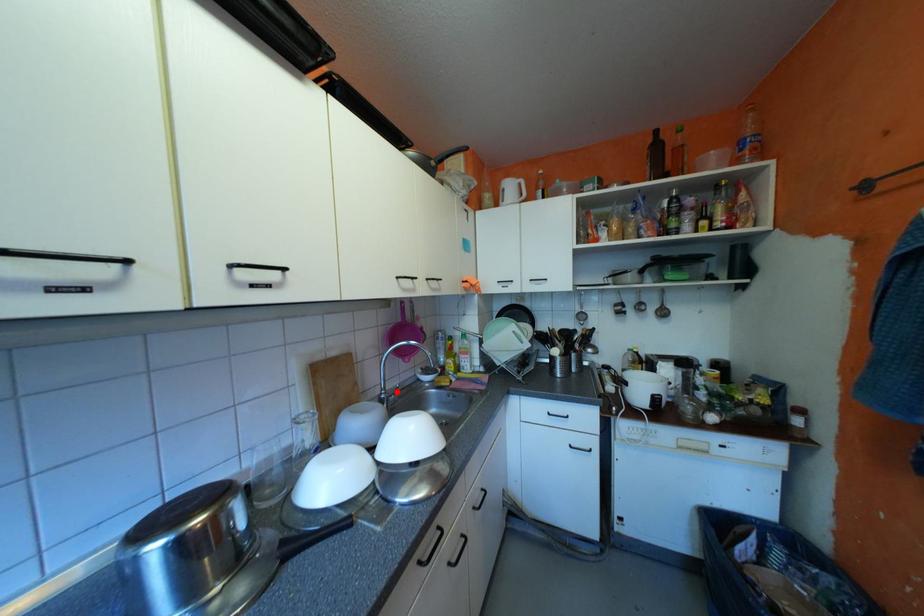
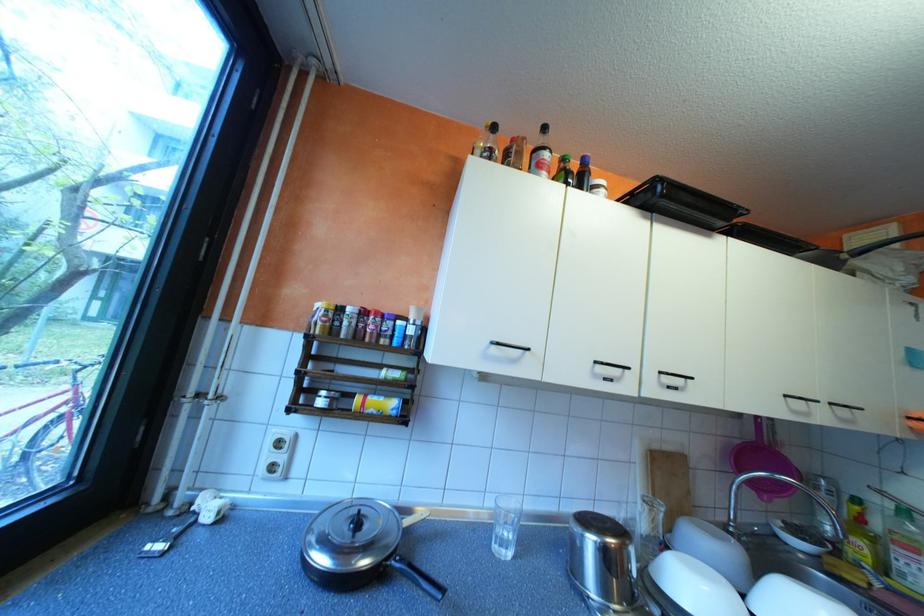
In the second image, find the point that corresponds to the highlighted location in the first image.

(747, 525)